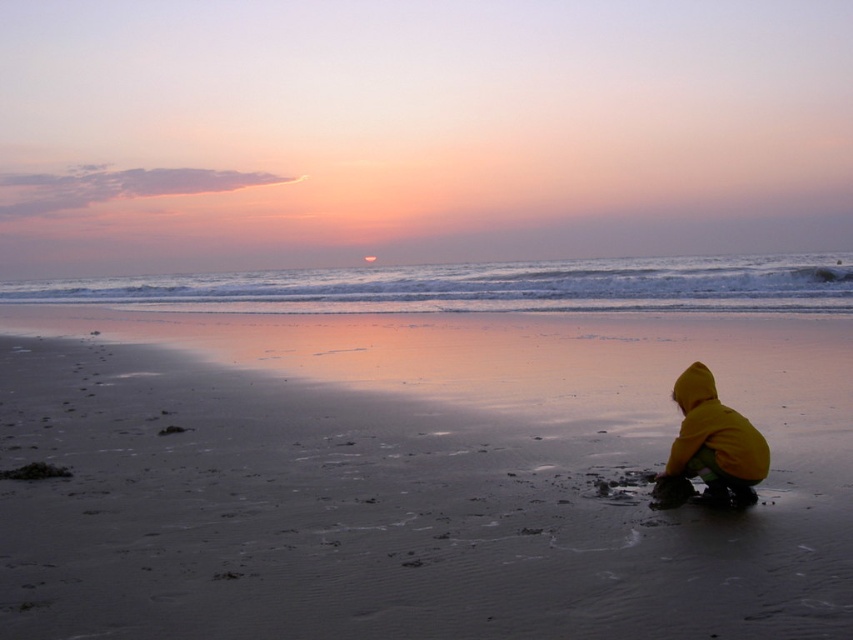
Does sandy beach at lower right come behind yellow fabric child at lower right?

No.

How much distance is there between sandy beach at lower right and yellow fabric child at lower right?

sandy beach at lower right is 3.23 meters away from yellow fabric child at lower right.

In order to click on sandy beach at lower right in this screenshot , I will do `click(408, 477)`.